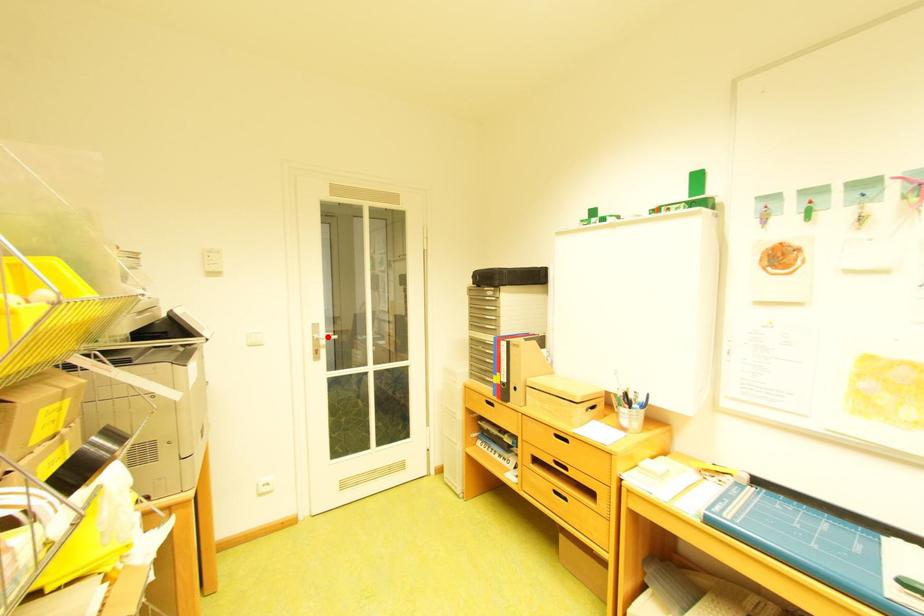
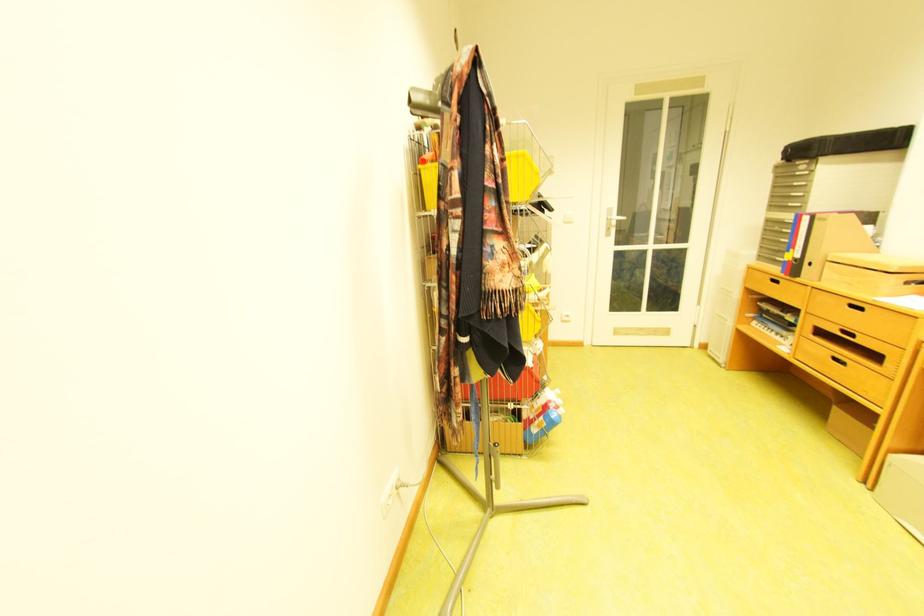
Question: I am providing you with two images of the same scene from different viewpoints. Given a red point in image1, look at the same physical point in image2. Is it:

Choices:
 (A) Closer to the viewpoint
 (B) Farther from the viewpoint

Answer: (B)